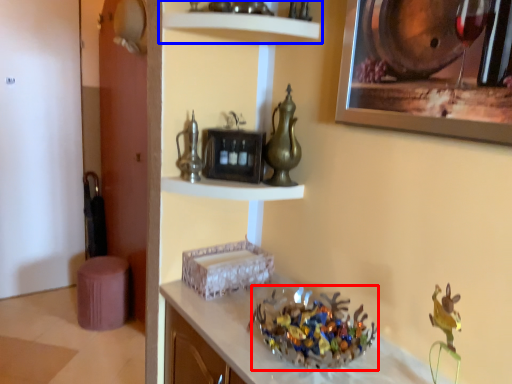
Question: Which object appears closest to the camera in this image, collection (highlighted by a red box) or shelf (highlighted by a blue box)?

Choices:
 (A) collection
 (B) shelf

Answer: (A)